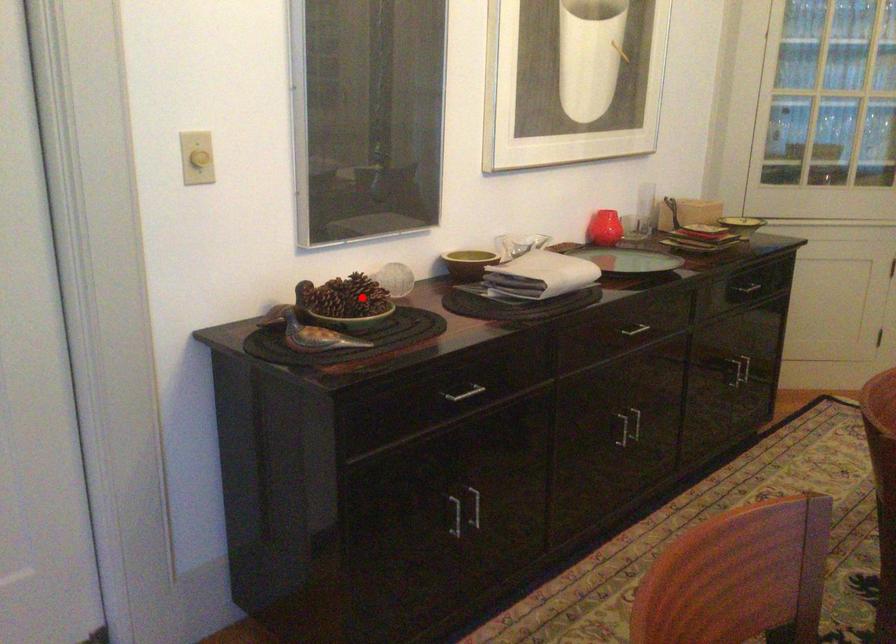
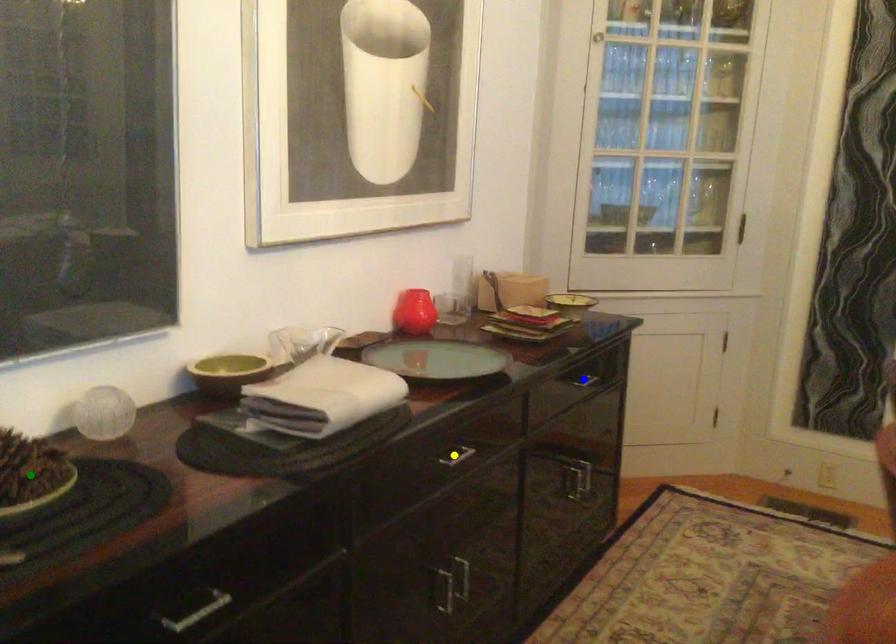
Question: I am providing you with two images of the same scene from different viewpoints. A red point is marked on the first image. You are given multiple points on the second image. Which spot in image 2 lines up with the point in image 1?

Choices:
 (A) yellow point
 (B) green point
 (C) blue point

Answer: (B)